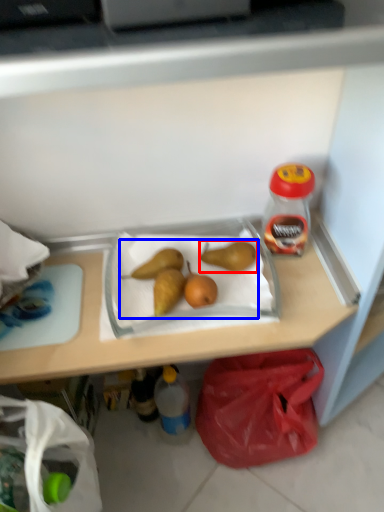
Question: Which of the following is the farthest to the observer, pear (highlighted by a red box) or fruit (highlighted by a blue box)?

Choices:
 (A) pear
 (B) fruit

Answer: (A)